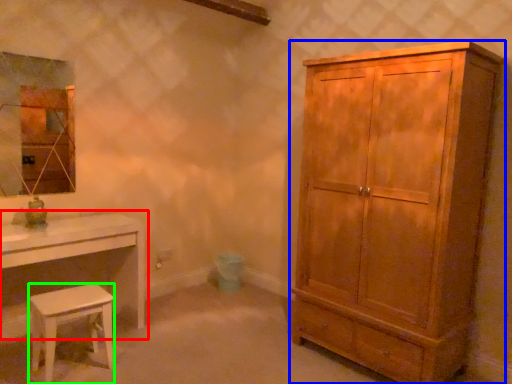
Question: Which object is the farthest from table (highlighted by a red box)? Choose among these: cabinetry (highlighted by a blue box) or stool (highlighted by a green box).

Choices:
 (A) cabinetry
 (B) stool

Answer: (A)